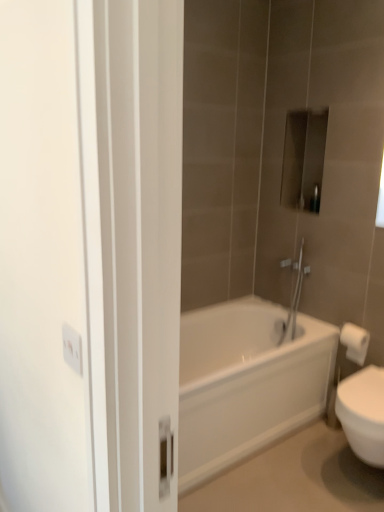
Image resolution: width=384 pixels, height=512 pixels. Describe the element at coordinates (315, 199) in the screenshot. I see `metallic rectangular object at upper center` at that location.

Image resolution: width=384 pixels, height=512 pixels. I want to click on metallic rectangular object at upper center, so click(x=315, y=199).

Can we say metallic rectangular object at upper center lies outside white paper towel at right?

Absolutely, metallic rectangular object at upper center is external to white paper towel at right.

Identify the location of toilet paper on the right of metallic rectangular object at upper center. This screenshot has width=384, height=512. (355, 342).

Based on the photo, which of these two, metallic rectangular object at upper center or white paper towel at right, stands shorter?

Standing shorter between the two is metallic rectangular object at upper center.

Is metallic rectangular object at upper center positioned far away from white paper towel at right?

That's not correct — metallic rectangular object at upper center is a little close to white paper towel at right.

From a real-world perspective, is white paper towel at right positioned over metallic rectangular object at upper center based on gravity?

No, from a real-world perspective, white paper towel at right is not above metallic rectangular object at upper center.

Who is smaller, white paper towel at right or metallic rectangular object at upper center?

Smaller between the two is metallic rectangular object at upper center.

Considering the relative sizes of white paper towel at right and metallic rectangular object at upper center in the image provided, is white paper towel at right wider than metallic rectangular object at upper center?

Yes, white paper towel at right is wider than metallic rectangular object at upper center.

From the image's perspective, who appears lower, white glossy bathtub at center or metallic rectangular object at upper center?

white glossy bathtub at center, from the image's perspective.

Can you confirm if white glossy bathtub at center is positioned to the left of metallic rectangular object at upper center?

Yes, white glossy bathtub at center is to the left of metallic rectangular object at upper center.

Is there a large distance between white glossy bathtub at center and metallic rectangular object at upper center?

That's right, there is a large distance between white glossy bathtub at center and metallic rectangular object at upper center.

Would you say white glossy bathtub at center contains metallic rectangular object at upper center?

Actually, metallic rectangular object at upper center is outside white glossy bathtub at center.

Does white paper towel at right have a larger size compared to white glossy bathtub at center?

Actually, white paper towel at right might be smaller than white glossy bathtub at center.

Is white paper towel at right situated inside white glossy bathtub at center or outside?

white paper towel at right is outside white glossy bathtub at center.

Is white paper towel at right in contact with white glossy bathtub at center?

white paper towel at right is not next to white glossy bathtub at center, and they're not touching.

Based on the photo, from the image's perspective, is metallic rectangular object at upper center above or below white glossy bathtub at center?

Clearly, from the image's perspective, metallic rectangular object at upper center is above white glossy bathtub at center.

From a real-world perspective, who is located higher, metallic rectangular object at upper center or white glossy bathtub at center?

In real-world perspective, metallic rectangular object at upper center is above.

Considering the sizes of metallic rectangular object at upper center and white glossy bathtub at center in the image, is metallic rectangular object at upper center bigger or smaller than white glossy bathtub at center?

Considering their sizes, metallic rectangular object at upper center takes up less space than white glossy bathtub at center.

Is metallic rectangular object at upper center completely or partially outside of white glossy bathtub at center?

Indeed, metallic rectangular object at upper center is completely outside white glossy bathtub at center.

Which of these two, white glossy bathtub at center or white paper towel at right, is wider?

white glossy bathtub at center is wider.

How distant is white glossy bathtub at center from white paper towel at right?

A distance of 21.88 inches exists between white glossy bathtub at center and white paper towel at right.

From a real-world perspective, between white glossy bathtub at center and white paper towel at right, who is vertically lower?

From a 3D spatial view, white glossy bathtub at center is below.

Is white glossy bathtub at center looking in the opposite direction of white paper towel at right?

white glossy bathtub at center does not have its back to white paper towel at right.

Find the location of a particular element. Image resolution: width=384 pixels, height=512 pixels. toiletry on the left side of white paper towel at right is located at coordinates (315, 199).

I want to click on toiletry above the white paper towel at right (from a real-world perspective), so click(315, 199).

Which object lies further to the anchor point white paper towel at right, metallic rectangular object at upper center or white glossy bathtub at center?

Based on the image, metallic rectangular object at upper center appears to be further to white paper towel at right.

From the image, which object appears to be nearer to metallic rectangular object at upper center, white paper towel at right or white glossy bathtub at center?

Based on the image, white paper towel at right appears to be nearer to metallic rectangular object at upper center.

Estimate the real-world distances between objects in this image. Which object is further from metallic rectangular object at upper center, white glossy bathtub at center or white paper towel at right?

white glossy bathtub at center.

When comparing their distances from white glossy bathtub at center, does metallic rectangular object at upper center or white paper towel at right seem closer?

white paper towel at right lies closer to white glossy bathtub at center than the other object.

Looking at the image, which one is located closer to white paper towel at right, white glossy bathtub at center or metallic rectangular object at upper center?

white glossy bathtub at center.

From the image, which object appears to be farther from white glossy bathtub at center, white paper towel at right or metallic rectangular object at upper center?

metallic rectangular object at upper center is further to white glossy bathtub at center.

You are a GUI agent. You are given a task and a screenshot of the screen. Output one action in this format:
    pyautogui.click(x=<x>, y=<y>)
    Task: Click on the toilet paper between metallic rectangular object at upper center and white glossy bathtub at center in the vertical direction
    
    Given the screenshot: What is the action you would take?
    pyautogui.click(x=355, y=342)